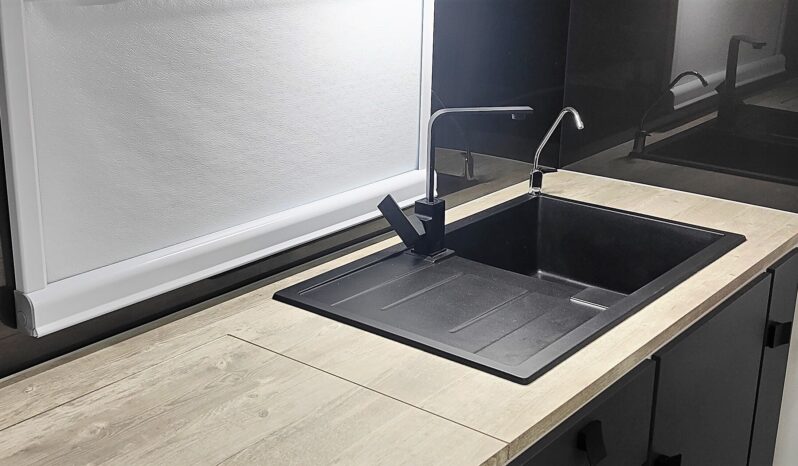
The height and width of the screenshot is (466, 798). I want to click on black backsplash to the right of sink, so click(x=731, y=96).